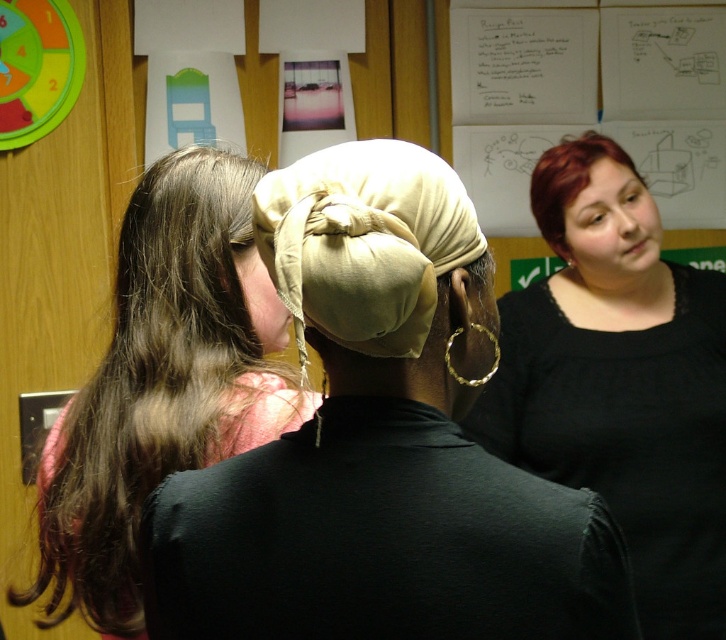
You are a GUI agent. You are given a task and a screenshot of the screen. Output one action in this format:
    pyautogui.click(x=<x>, y=<y>)
    Task: Click on the white paper at upper right
    Image resolution: width=726 pixels, height=640 pixels.
    Given the screenshot: What is the action you would take?
    pyautogui.click(x=591, y=106)

Who is shorter, white paper at upper right or matte black head at right?

matte black head at right is shorter.

Is point (489, 179) in front of point (562, 170)?

No, (489, 179) is further to viewer.

Locate an element on the screen. white paper at upper right is located at coordinates (591, 106).

Is dark brown hair at left smaller than matte black head at right?

Actually, dark brown hair at left might be larger than matte black head at right.

Find the location of `dark brown hair at left`. dark brown hair at left is located at coordinates (163, 381).

Which is more to the right, white paper at upper right or beige fabric headscarf at center?

Positioned to the right is white paper at upper right.

Is white paper at upper right to the left of beige fabric headscarf at center from the viewer's perspective?

No, white paper at upper right is not to the left of beige fabric headscarf at center.

Describe the element at coordinates (591, 106) in the screenshot. This screenshot has height=640, width=726. I see `white paper at upper right` at that location.

At what (x,y) coordinates should I click in order to perform the action: click on white paper at upper right. Please return your answer as a coordinate pair (x, y). Looking at the image, I should click on (591, 106).